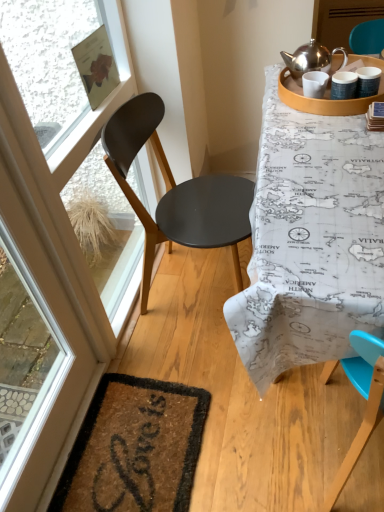
Image resolution: width=384 pixels, height=512 pixels. What are the coordinates of `free spot above matte wooden tray at upper right (from a real-world perspective)` in the screenshot? It's located at tap(347, 75).